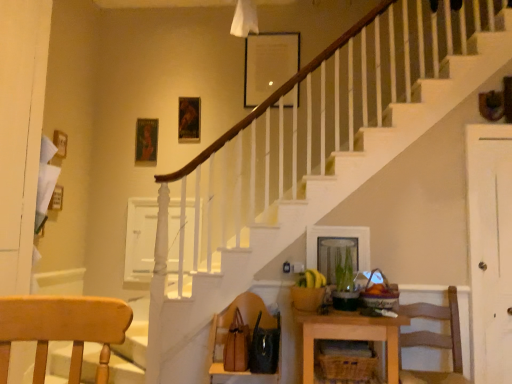
Question: Can you confirm if wooden table at lower center is thinner than woven brown basket at lower center?

Choices:
 (A) yes
 (B) no

Answer: (B)

Question: From a real-world perspective, is wooden table at lower center physically below woven brown basket at lower center?

Choices:
 (A) yes
 (B) no

Answer: (A)

Question: Does wooden table at lower center appear on the left side of woven brown basket at lower center?

Choices:
 (A) no
 (B) yes

Answer: (A)

Question: Could you tell me if wooden table at lower center is turned towards woven brown basket at lower center?

Choices:
 (A) yes
 (B) no

Answer: (A)

Question: Is wooden table at lower center taller than woven brown basket at lower center?

Choices:
 (A) no
 (B) yes

Answer: (B)

Question: Is white wood door at right wider or thinner than woven brown basket at lower center?

Choices:
 (A) wide
 (B) thin

Answer: (B)

Question: From the image's perspective, is white wood door at right located above or below woven brown basket at lower center?

Choices:
 (A) above
 (B) below

Answer: (A)

Question: Considering the positions of white wood door at right and woven brown basket at lower center in the image, is white wood door at right taller or shorter than woven brown basket at lower center?

Choices:
 (A) short
 (B) tall

Answer: (B)

Question: Would you say white wood door at right is to the left or to the right of woven brown basket at lower center in the picture?

Choices:
 (A) left
 (B) right

Answer: (B)

Question: From a real-world perspective, is wooden chair at lower right, marked as the 2th chair in a left-to-right arrangement, physically located above or below brown leather handbag at lower center, the 1th chair when ordered from left to right?

Choices:
 (A) below
 (B) above

Answer: (B)

Question: Is point (456, 375) positioned closer to the camera than point (207, 354)?

Choices:
 (A) farther
 (B) closer

Answer: (B)

Question: Considering the positions of wooden chair at lower right, marked as the 2th chair in a left-to-right arrangement, and brown leather handbag at lower center, which ranks as the 2th chair in right-to-left order, in the image, is wooden chair at lower right, marked as the 2th chair in a left-to-right arrangement, taller or shorter than brown leather handbag at lower center, which ranks as the 2th chair in right-to-left order,?

Choices:
 (A) tall
 (B) short

Answer: (A)

Question: Based on their sizes in the image, would you say wooden chair at lower right, marked as the 2th chair in a left-to-right arrangement, is bigger or smaller than brown leather handbag at lower center, the 1th chair when ordered from left to right?

Choices:
 (A) big
 (B) small

Answer: (A)

Question: From a real-world perspective, is wooden chair at lower right, marked as the 2th chair in a left-to-right arrangement, positioned above or below woven brown basket at lower center?

Choices:
 (A) below
 (B) above

Answer: (B)

Question: From the image's perspective, relative to woven brown basket at lower center, is wooden chair at lower right, which ranks as the 1th chair in right-to-left order, above or below?

Choices:
 (A) below
 (B) above

Answer: (B)